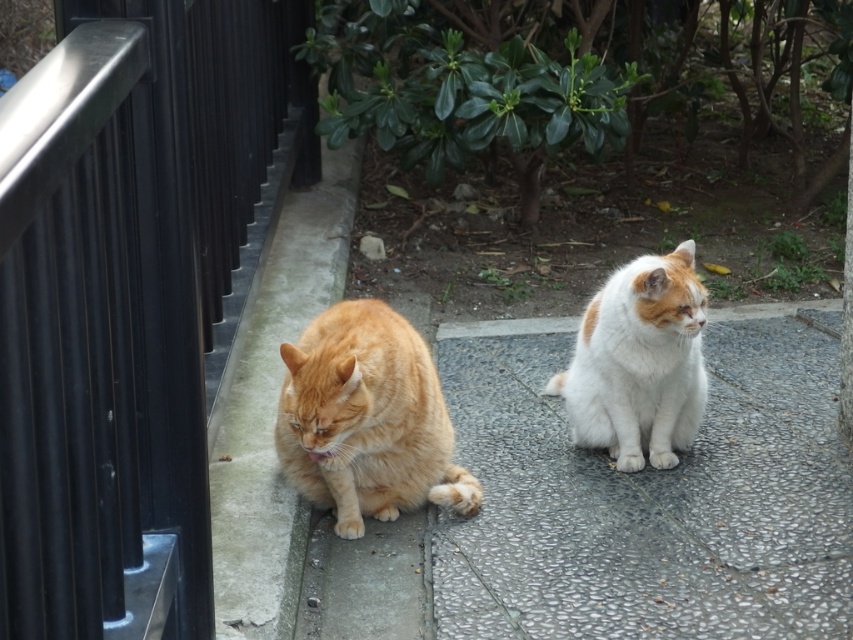
You are standing at the center of the pavement where the two cats are sitting. Looking towards the black metal rail at left, in which direction should you turn to face it?

The black metal rail at left is located at point coordinates relative to the image frame, so turning left from the center position would orient you toward it.

You are a delivery robot with a width of 1.2 meters. You need to move from the black metal rail at left to the white speckled concrete at center. Is there enough space for you to pass through the area between them?

The distance between the black metal rail at left and the white speckled concrete at center is 1.68 meters. Since the robot is 1.2 meters wide, there is sufficient space for it to pass through the area between them.

You are a photographer trying to capture both the orange fur cat at left and the white fluffy cat at center in a single frame. Given their sizes, which cat would you need to position closer to the camera to ensure both appear equally sized in the photo?

The orange fur cat at left is wider than the white fluffy cat at center. To make them appear equally sized in the photo, you should position the white fluffy cat at center closer to the camera since it is narrower.